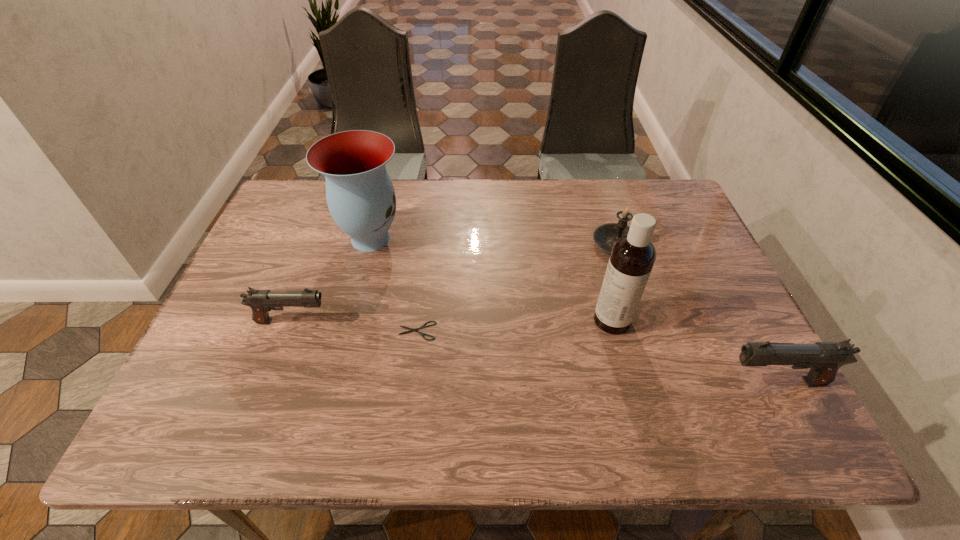
Identify the location of the fifth tallest object. This screenshot has width=960, height=540. (261, 302).

Identify the location of the left gun. The height and width of the screenshot is (540, 960). (261, 302).

I want to click on the rightmost object, so click(824, 359).

Where is `the nearer gun`? The height and width of the screenshot is (540, 960). the nearer gun is located at coordinates (824, 359).

Where is `vase`? The height and width of the screenshot is (540, 960). vase is located at coordinates (361, 199).

Where is `dishwasher detergent`? The height and width of the screenshot is (540, 960). dishwasher detergent is located at coordinates (632, 258).

Image resolution: width=960 pixels, height=540 pixels. Identify the location of shears. (423, 326).

Identify the location of the third object from left to right. The image size is (960, 540). (423, 326).

Image resolution: width=960 pixels, height=540 pixels. I want to click on candle, so click(x=604, y=236).

Image resolution: width=960 pixels, height=540 pixels. I want to click on free space located in the direction the farther gun is aimed, so click(418, 321).